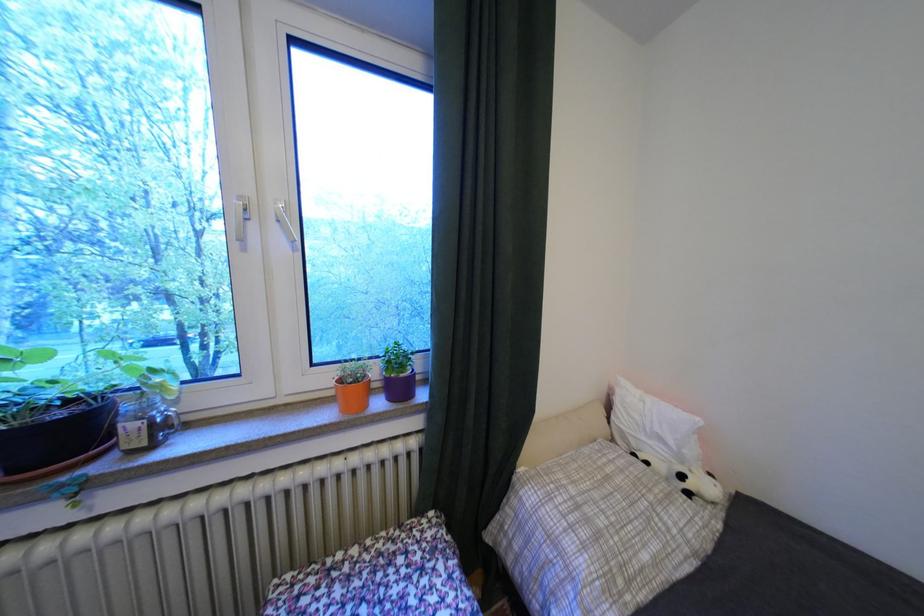
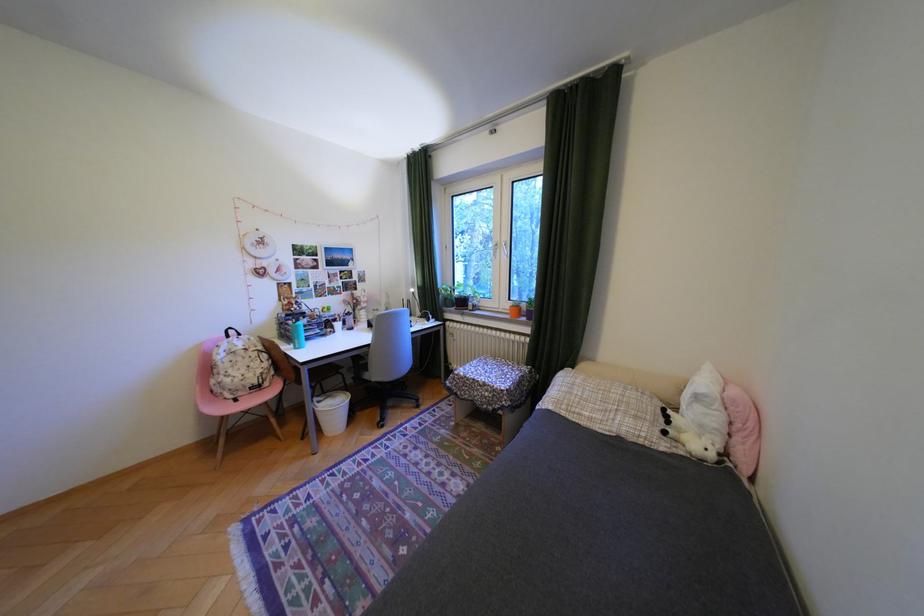
The point at (x=700, y=495) is marked in the first image. Where is the corresponding point in the second image?

(676, 432)